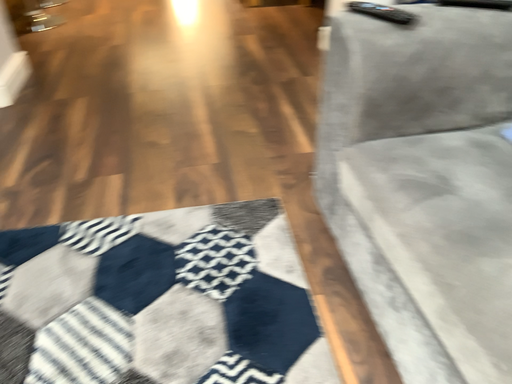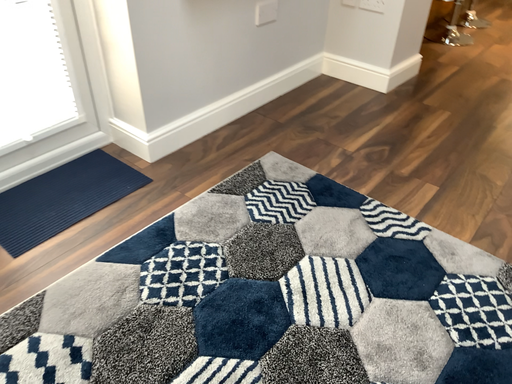
Question: Which way did the camera rotate in the video?

Choices:
 (A) rotated upward
 (B) rotated downward

Answer: (A)